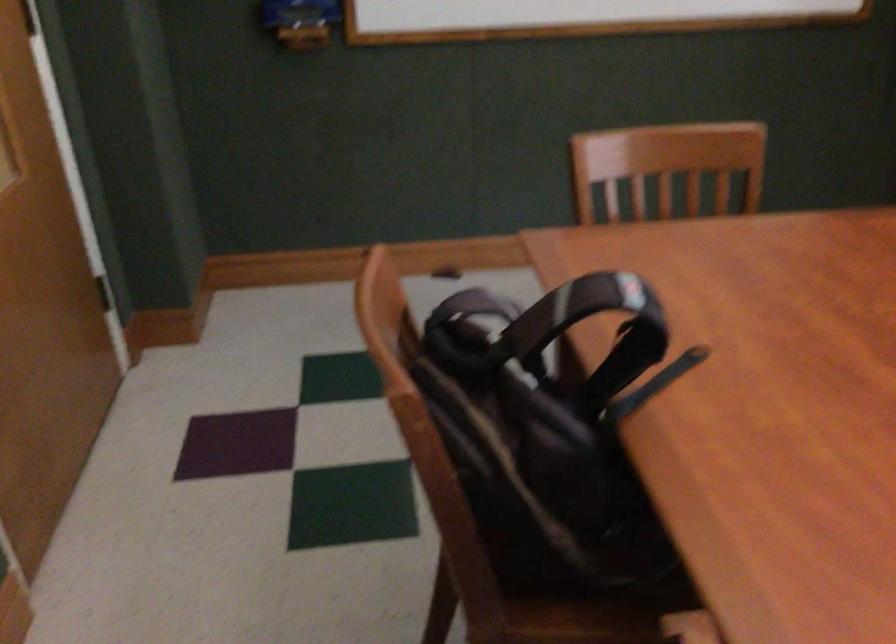
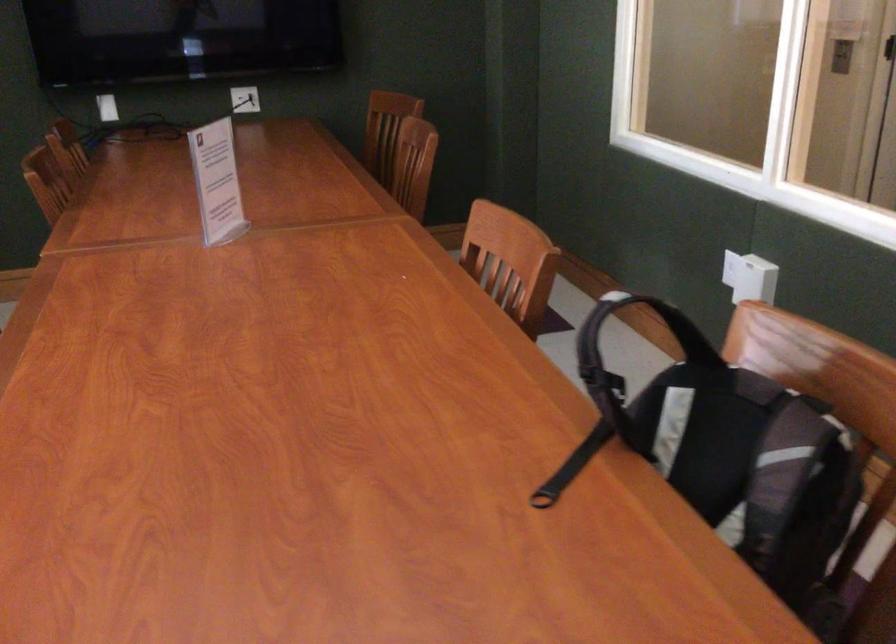
Where in the second image is the point corresponding to (480,304) from the first image?

(796, 456)